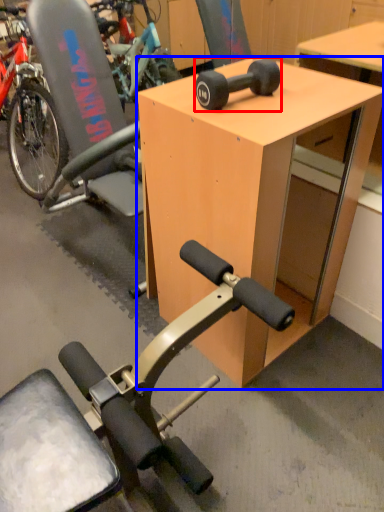
Question: Among these objects, which one is farthest to the camera, wheel (highlighted by a red box) or desk (highlighted by a blue box)?

Choices:
 (A) wheel
 (B) desk

Answer: (A)